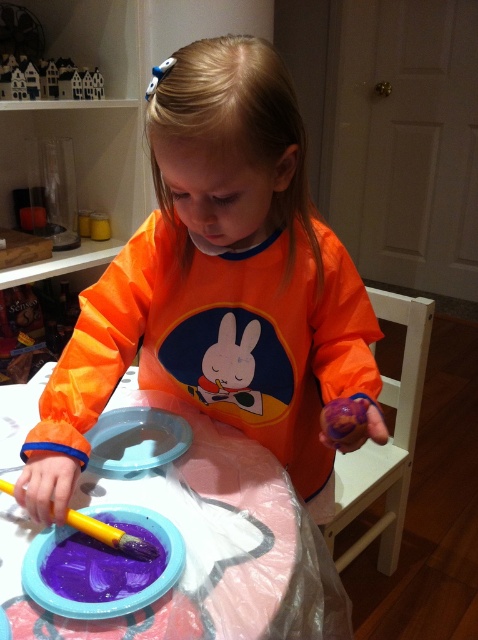
In the scene shown: You are a painter standing in front of the plastic covered table at center and the transparent plastic plate at center. Which object is positioned to the left?

The plastic covered table at center is to the left of the transparent plastic plate at center, so the plastic covered table at center is positioned to the left.

You are a painter observing the scene. You see the orange matte shirt at center and the wooden toy houses at upper left. Which object is more to the right?

The orange matte shirt at center is positioned on the right side of wooden toy houses at upper left, so it is more to the right.